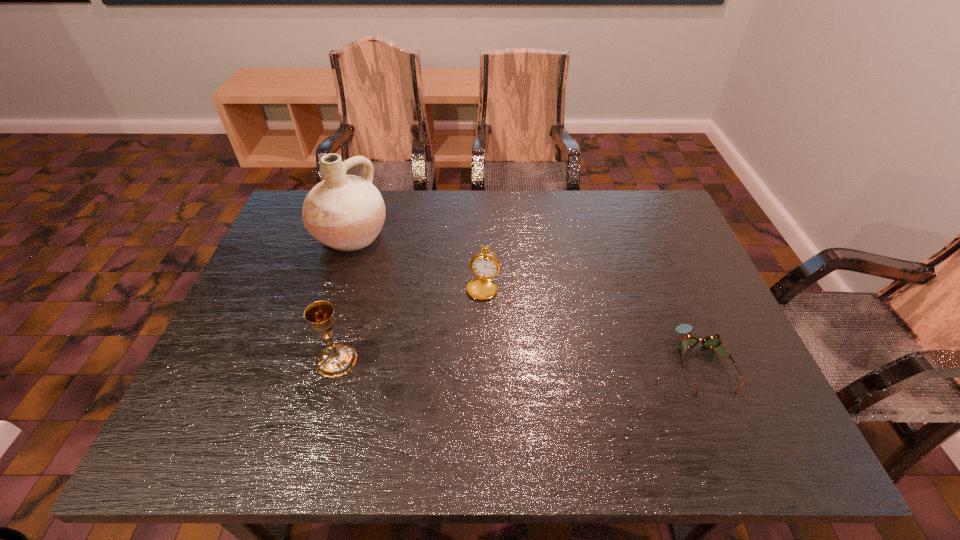
Where is `the second tallest object`? The image size is (960, 540). the second tallest object is located at coordinates (337, 360).

Image resolution: width=960 pixels, height=540 pixels. I want to click on spectacles, so click(712, 341).

Locate an element on the screen. Image resolution: width=960 pixels, height=540 pixels. the rightmost object is located at coordinates (712, 341).

The height and width of the screenshot is (540, 960). I want to click on pocket watch, so click(485, 265).

This screenshot has width=960, height=540. Identify the location of the second shortest object. (485, 265).

What are the coordinates of `pottery` in the screenshot? It's located at (345, 212).

At what (x,y) coordinates should I click in order to perform the action: click on the farthest object. Please return your answer as a coordinate pair (x, y). Looking at the image, I should click on (345, 212).

Identify the location of free location located on the back of the chalice. (355, 294).

Find the location of `vacant space located 0.230m on the face of the third tallest object`. vacant space located 0.230m on the face of the third tallest object is located at coordinates (468, 380).

Locate an element on the screen. This screenshot has height=540, width=960. vacant space positioned 0.080m on the face of the third tallest object is located at coordinates (482, 327).